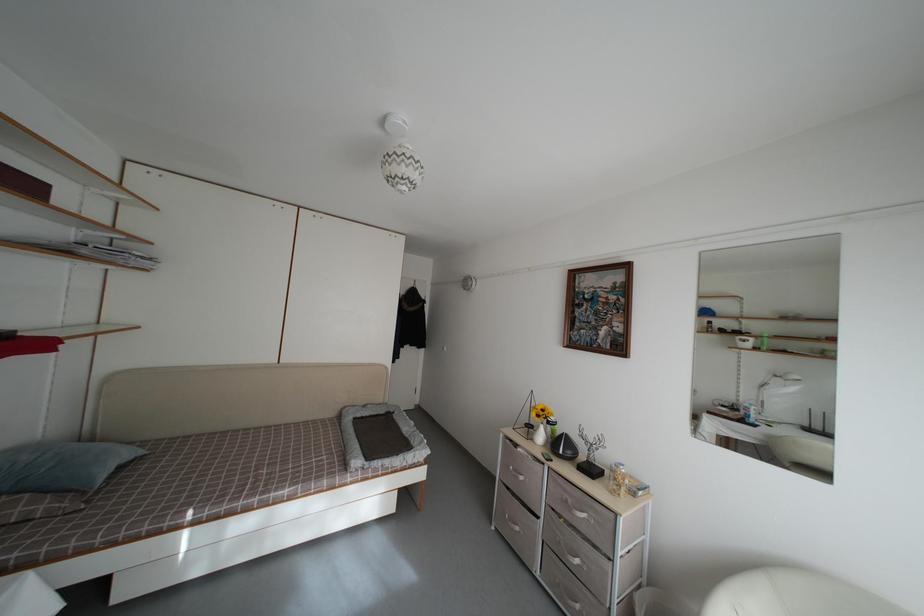
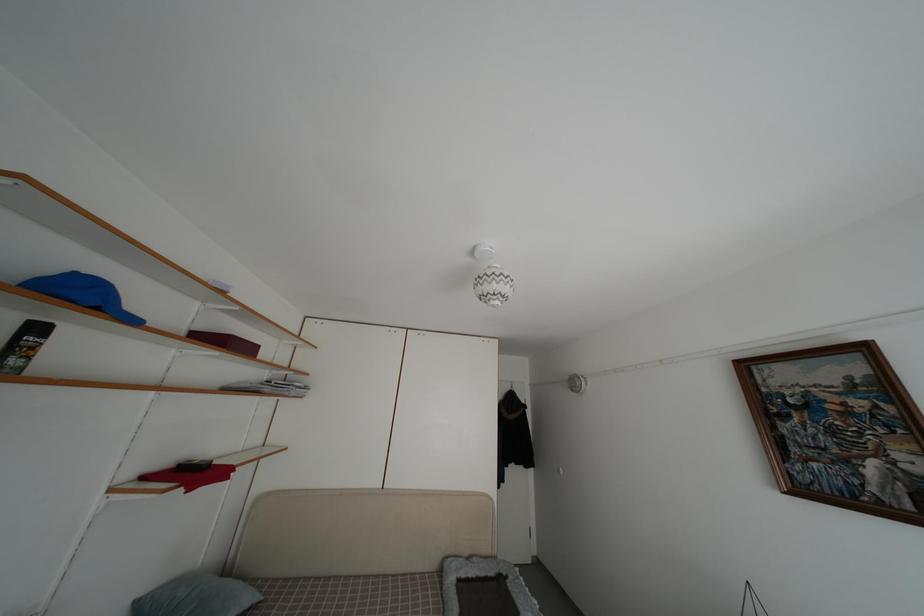
The point at [30,192] is marked in the first image. Where is the corresponding point in the second image?

(253, 355)